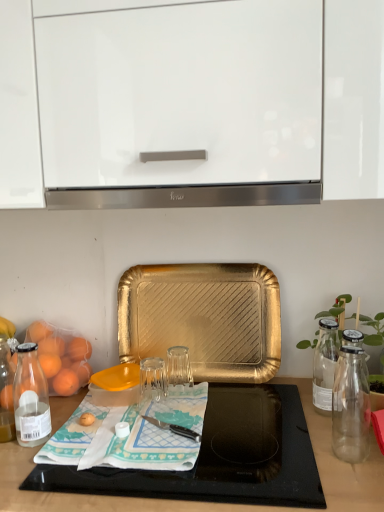
You are a GUI agent. You are given a task and a screenshot of the screen. Output one action in this format:
    pyautogui.click(x=<x>, y=<y>)
    Task: Click on the vacant location below satin silver exhaust hood at center (from a real-world perspective)
    The image size is (384, 512).
    Given the screenshot: What is the action you would take?
    pyautogui.click(x=242, y=411)